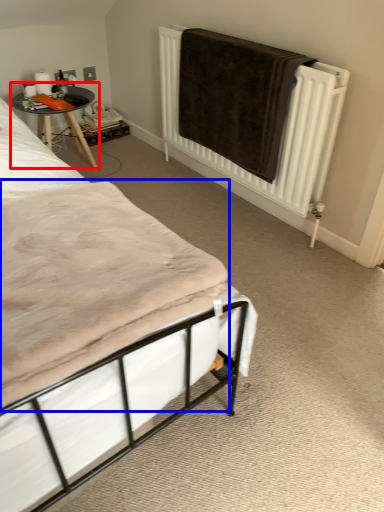
Question: Which object is further to the camera taking this photo, table (highlighted by a red box) or mattress (highlighted by a blue box)?

Choices:
 (A) table
 (B) mattress

Answer: (A)